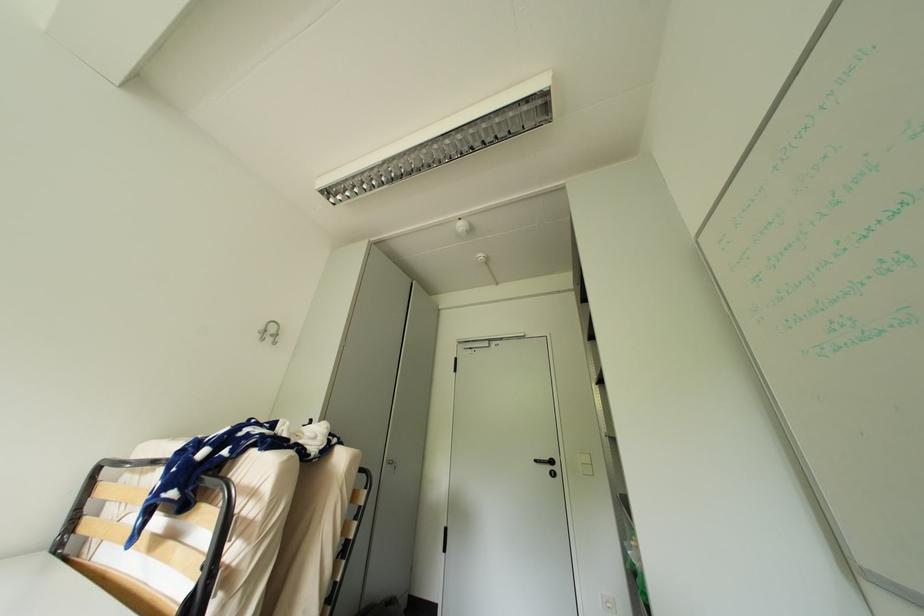
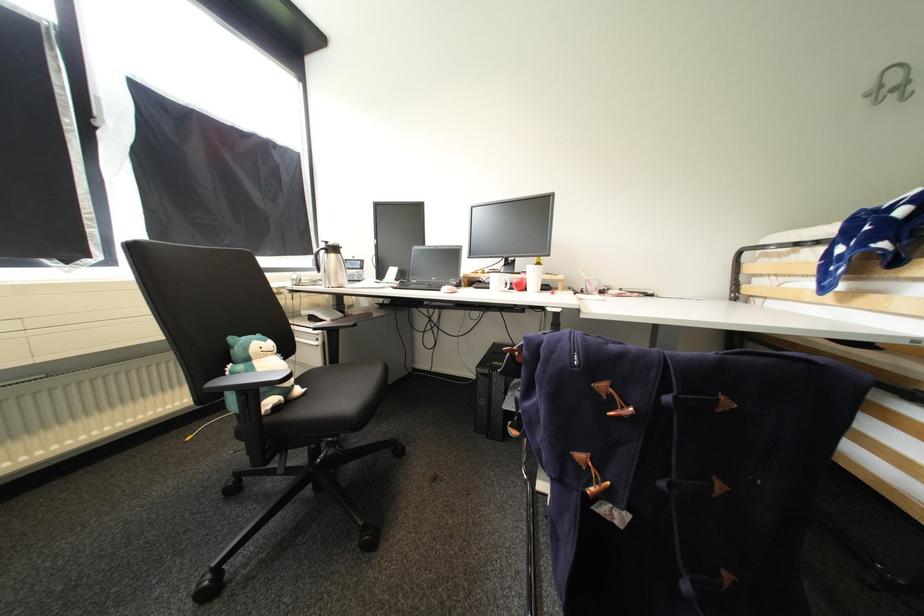
Question: The first image is from the beginning of the video and the second image is from the end. How did the camera likely rotate when shooting the video?

Choices:
 (A) Left
 (B) Right
 (C) Up
 (D) Down

Answer: (A)